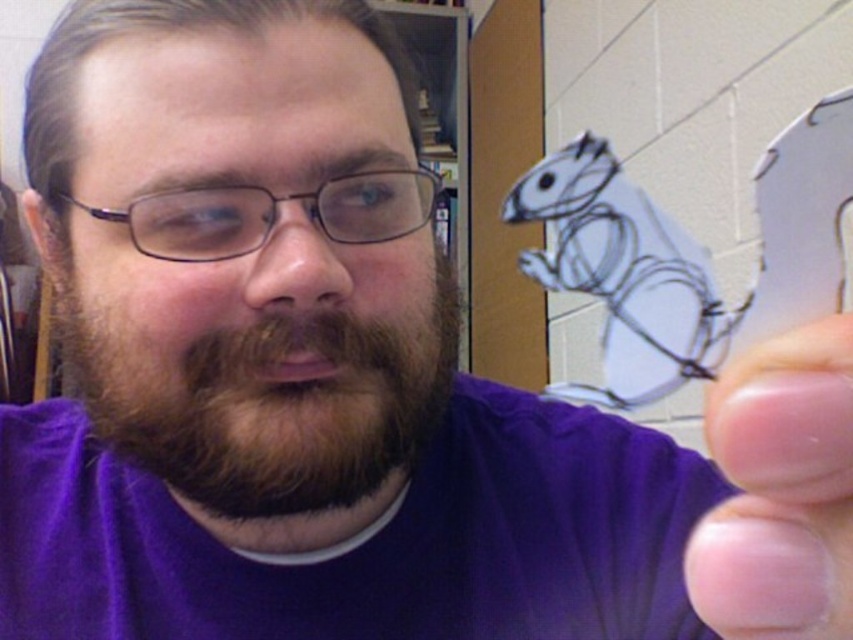
Question: Is brownwoollybeard at center behind white paper squirrel at upper center?

Choices:
 (A) yes
 (B) no

Answer: (B)

Question: Which is farther from the white paper squirrel at upper center?

Choices:
 (A) transparent plastic hand at right
 (B) brownwoollybeard at center

Answer: (A)

Question: Which of the following is the closest to the observer?

Choices:
 (A) (732, 538)
 (B) (543, 188)

Answer: (A)

Question: Can you confirm if transparent plastic hand at right is wider than white paper squirrel at upper center?

Choices:
 (A) yes
 (B) no

Answer: (B)

Question: Is brownwoollybeard at center smaller than white paper squirrel at upper center?

Choices:
 (A) no
 (B) yes

Answer: (B)

Question: Which object is the farthest from the transparent plastic hand at right?

Choices:
 (A) brownwoollybeard at center
 (B) white paper squirrel at upper center

Answer: (B)